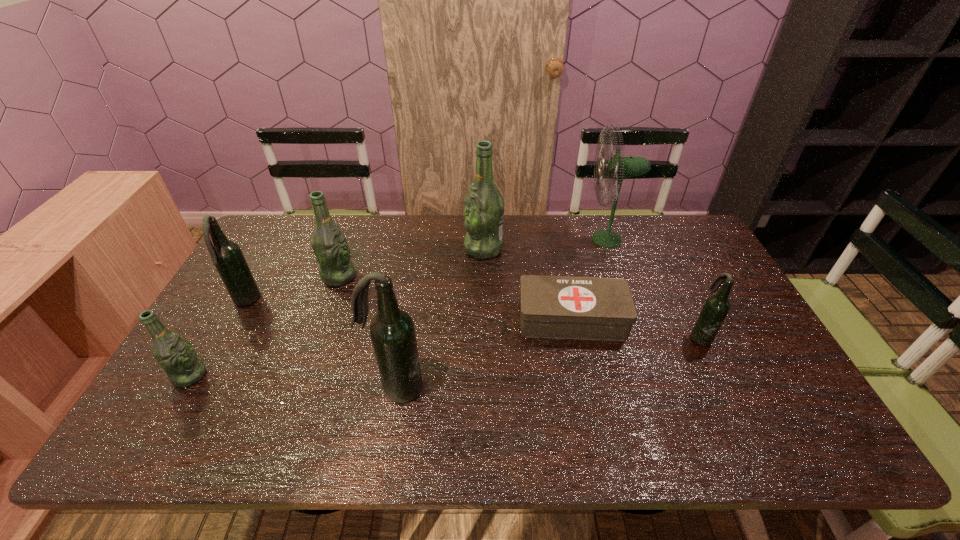
Where is `empty location between the fourth object from right to left and the second nearest green beer bottle`? This screenshot has width=960, height=540. empty location between the fourth object from right to left and the second nearest green beer bottle is located at coordinates (412, 262).

Find the location of a particular element. This screenshot has height=540, width=960. vacant area that lies between the third nearest beer bottle and the second dark beer bottle from right to left is located at coordinates (548, 362).

Select which object appears as the closest to the fourth nearest beer bottle. Please provide its 2D coordinates. Your answer should be formatted as a tuple, i.e. [(x, y)], where the tuple contains the x and y coordinates of a point satisfying the conditions above.

[(330, 247)]

The image size is (960, 540). Identify the location of object that is the fourth closest to the farthest green beer bottle. 392,331.

Locate which beer bottle is the closest to the nearest green beer bottle. Please provide its 2D coordinates. Your answer should be formatted as a tuple, i.e. [(x, y)], where the tuple contains the x and y coordinates of a point satisfying the conditions above.

[(226, 255)]

Where is `beer bottle that stands as the second closest to the fan`? Image resolution: width=960 pixels, height=540 pixels. beer bottle that stands as the second closest to the fan is located at coordinates (484, 206).

At what (x,y) coordinates should I click in order to perform the action: click on green beer bottle that is the second closest to the second green beer bottle from right to left. Please return your answer as a coordinate pair (x, y). Looking at the image, I should click on (175, 354).

Find the location of a particular element. green beer bottle that stands as the third closest to the rightmost object is located at coordinates [175, 354].

Identify which dark beer bottle is the closest to the green fan. Please provide its 2D coordinates. Your answer should be formatted as a tuple, i.e. [(x, y)], where the tuple contains the x and y coordinates of a point satisfying the conditions above.

[(716, 307)]

Select which dark beer bottle is the second closest to the green fan. Please provide its 2D coordinates. Your answer should be formatted as a tuple, i.e. [(x, y)], where the tuple contains the x and y coordinates of a point satisfying the conditions above.

[(392, 331)]